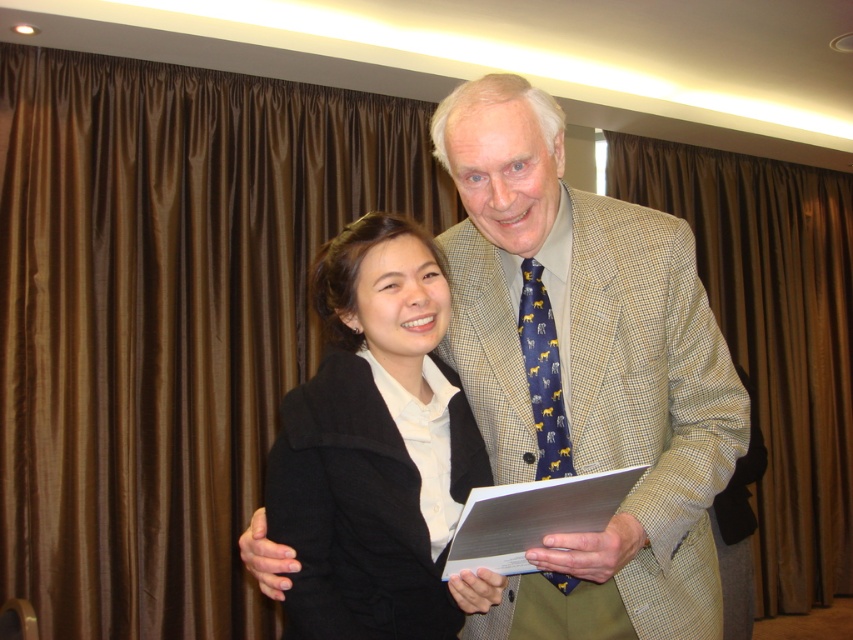
You are a photographer positioned at the camera. You want to capture a closeup shot of the brown satin curtain at left without moving the camera. Is it possible to do so?

The brown satin curtain at left is 8.74 feet away from camera, so yes, the photographer can capture a closeup shot of the brown satin curtain at left without moving the camera since it is within a reasonable distance for focusing.

You are a photographer setting up for a formal event. You notice the brown satin curtain at left and the navy blue silk tie at center in the scene. Which object is taller?

The brown satin curtain at left has a greater height compared to the navy blue silk tie at center, so the brown satin curtain at left is taller.